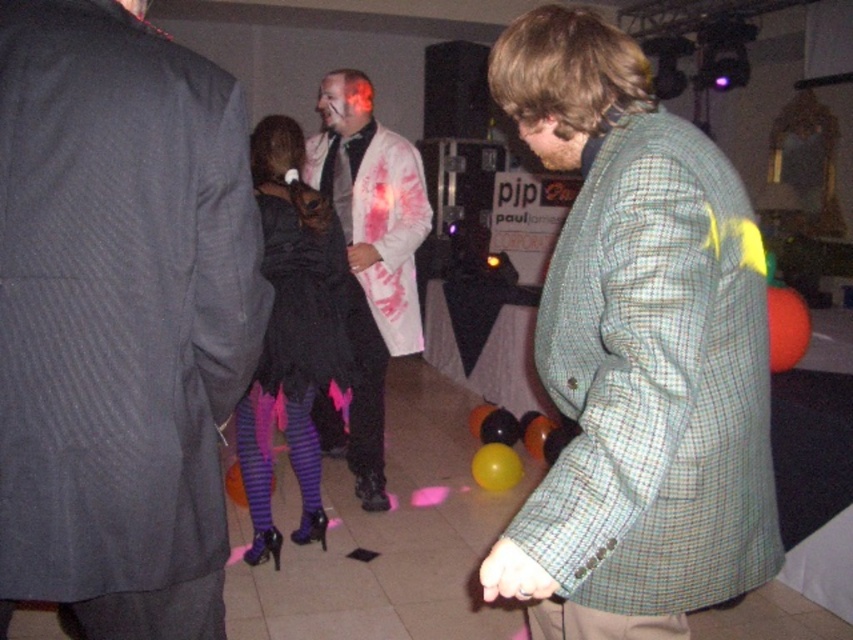
Who is taller, green checkered jacket at center or black rubber balloon at center?

With more height is green checkered jacket at center.

Find the location of a particular element. This screenshot has height=640, width=853. green checkered jacket at center is located at coordinates (636, 353).

You are a GUI agent. You are given a task and a screenshot of the screen. Output one action in this format:
    pyautogui.click(x=<x>, y=<y>)
    Task: Click on the green checkered jacket at center
    Image resolution: width=853 pixels, height=640 pixels.
    Given the screenshot: What is the action you would take?
    pyautogui.click(x=636, y=353)

Which is behind, point (407, 253) or point (485, 456)?

Positioned behind is point (485, 456).

How much distance is there between white textured coat at center and yellow rubber balloon at center?

white textured coat at center and yellow rubber balloon at center are 29.67 inches apart from each other.

The image size is (853, 640). Find the location of `white textured coat at center`. white textured coat at center is located at coordinates (370, 253).

Who is higher up, green checkered jacket at center or black satin dress at center?

green checkered jacket at center

Who is lower down, green checkered jacket at center or black satin dress at center?

black satin dress at center is below.

What are the coordinates of `green checkered jacket at center` in the screenshot? It's located at (636, 353).

Find the location of a particular element. green checkered jacket at center is located at coordinates (636, 353).